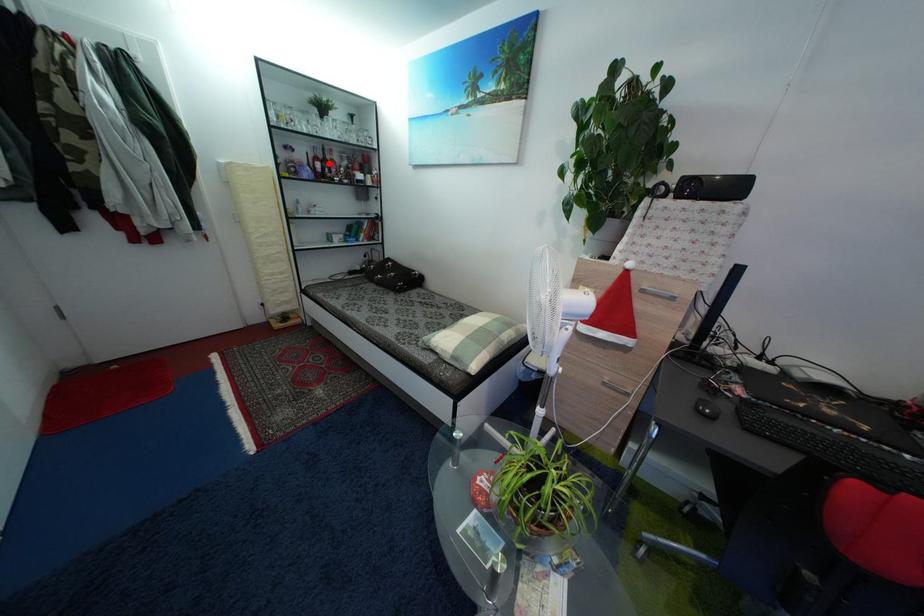
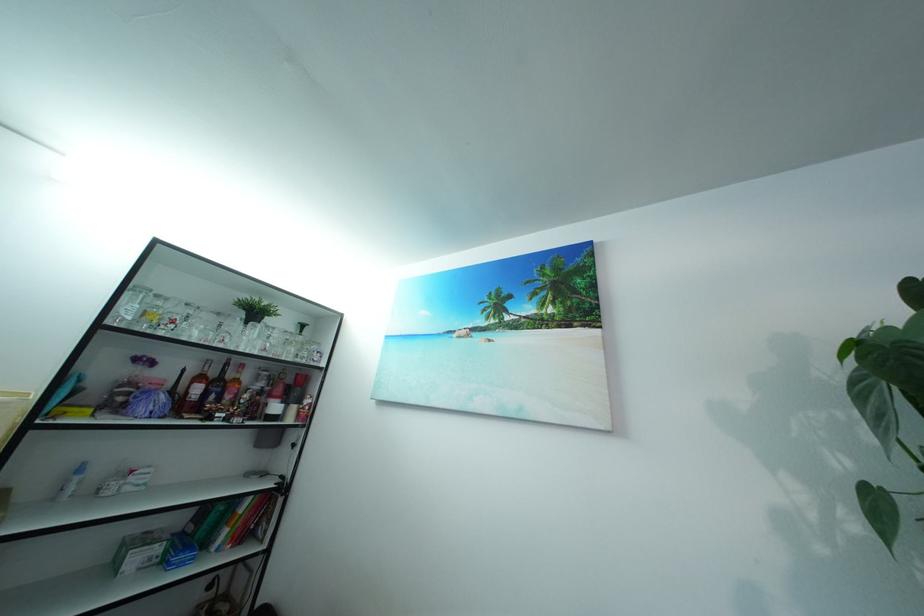
In the second image, find the point that corresponds to the highlighted location in the first image.

(222, 381)